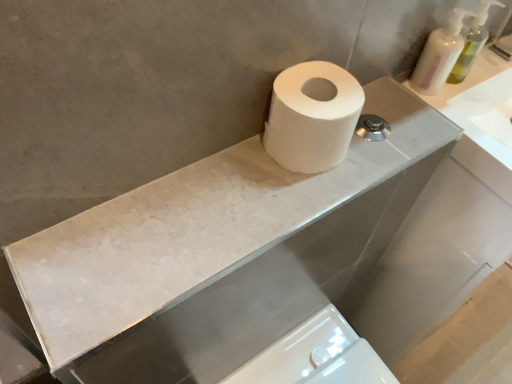
What are the coordinates of `free space in front of white matte toilet paper at center` in the screenshot? It's located at (261, 215).